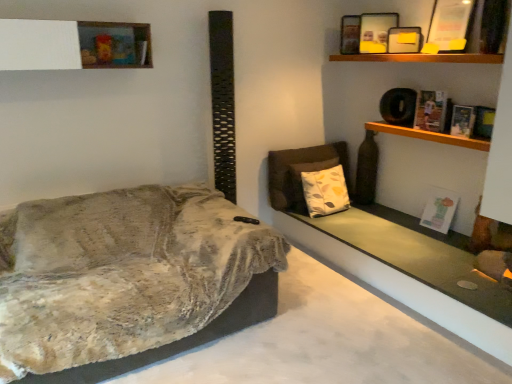
At what (x,y) coordinates should I click in order to perform the action: click on wooden shelf at upper right, the 2th shelf positioned from the top. Please return your answer as a coordinate pair (x, y). The image size is (512, 384). Looking at the image, I should click on (428, 136).

The width and height of the screenshot is (512, 384). What do you see at coordinates (122, 272) in the screenshot?
I see `velvet beige couch at left` at bounding box center [122, 272].

This screenshot has height=384, width=512. Describe the element at coordinates (376, 31) in the screenshot. I see `matte black picture frame at upper right, placed as the first picture frame when sorted from back to front` at that location.

Where is `wooden shelf at upper right, the first shelf ordered from the bottom`? The height and width of the screenshot is (384, 512). wooden shelf at upper right, the first shelf ordered from the bottom is located at coordinates (428, 136).

Is matte black picture frame at upper right, placed as the first picture frame when sorted from back to front, oriented towards brown fabric armchair at center?

No, matte black picture frame at upper right, placed as the first picture frame when sorted from back to front, is not facing towards brown fabric armchair at center.

Who is smaller, matte black picture frame at upper right, placed as the first picture frame when sorted from back to front, or brown fabric armchair at center?

Smaller between the two is matte black picture frame at upper right, placed as the first picture frame when sorted from back to front.

Can you confirm if matte black picture frame at upper right, arranged as the 2th picture frame when viewed from the front, is shorter than brown fabric armchair at center?

Yes, matte black picture frame at upper right, arranged as the 2th picture frame when viewed from the front, is shorter than brown fabric armchair at center.

Are matte black picture frame at upper right, placed as the first picture frame when sorted from back to front, and brown fabric armchair at center far apart?

matte black picture frame at upper right, placed as the first picture frame when sorted from back to front, is positioned a significant distance from brown fabric armchair at center.

Are brown fabric armchair at center and smooth concrete window sill at lower right making contact?

No, brown fabric armchair at center is not in contact with smooth concrete window sill at lower right.

Would you say brown fabric armchair at center is inside or outside smooth concrete window sill at lower right?

brown fabric armchair at center is outside smooth concrete window sill at lower right.

From a real-world perspective, between brown fabric armchair at center and smooth concrete window sill at lower right, who is vertically lower?

In real-world perspective, smooth concrete window sill at lower right is lower.

In order to click on armchair that is behind the smooth concrete window sill at lower right in this screenshot , I will do `click(301, 172)`.

Consider the image. From a real-world perspective, who is located lower, white matte shelf at upper left, marked as the 2th shelf in a right-to-left arrangement, or hardcover book at upper right, placed as the second book when sorted from bottom to top?

hardcover book at upper right, placed as the second book when sorted from bottom to top, is physically lower.

Which shelf is the 2nd one when counting from the left side of the hardcover book at upper right, the 3th book when ordered from top to bottom? Please provide its 2D coordinates.

[(65, 44)]

Between white matte shelf at upper left, the 1th shelf when ordered from top to bottom, and hardcover book at upper right, placed as the second book when sorted from bottom to top, which one has more height?

With more height is white matte shelf at upper left, the 1th shelf when ordered from top to bottom.

Considering the positions of objects white matte shelf at upper left, the 2th shelf positioned from the bottom, and hardcover book at upper right, the 3th book when ordered from top to bottom, in the image provided, who is behind, white matte shelf at upper left, the 2th shelf positioned from the bottom, or hardcover book at upper right, the 3th book when ordered from top to bottom,?

hardcover book at upper right, the 3th book when ordered from top to bottom, is behind.

How many degrees apart are the facing directions of matte black picture frame at upper right, arranged as the 2th picture frame when viewed from the front, and hardcover book at upper right, the 3th book when ordered from top to bottom?

matte black picture frame at upper right, arranged as the 2th picture frame when viewed from the front, and hardcover book at upper right, the 3th book when ordered from top to bottom, are facing 86.2 degrees away from each other.

Between matte black picture frame at upper right, arranged as the 2th picture frame when viewed from the front, and hardcover book at upper right, placed as the second book when sorted from bottom to top, which one has smaller size?

Smaller between the two is hardcover book at upper right, placed as the second book when sorted from bottom to top.

Is matte black picture frame at upper right, placed as the first picture frame when sorted from back to front, in front of hardcover book at upper right, placed as the second book when sorted from bottom to top?

That is False.

Is matte black picture frame at upper right, placed as the first picture frame when sorted from back to front, shorter than hardcover book at upper right, placed as the second book when sorted from bottom to top?

No.

Can you tell me how much white paper at upper right, the fourth book positioned from the top, and matte black picture frame at upper center, arranged as the first picture frame when viewed from the front, differ in facing direction?

52.1 degrees.

From the image's perspective, is white paper at upper right, the fourth book positioned from the top, positioned above or below matte black picture frame at upper center, marked as the second picture frame in a back-to-front arrangement?

Clearly, from the image's perspective, white paper at upper right, the fourth book positioned from the top, is below matte black picture frame at upper center, marked as the second picture frame in a back-to-front arrangement.

Looking at this image, would you consider white paper at upper right, the fourth book positioned from the top, to be distant from matte black picture frame at upper center, arranged as the first picture frame when viewed from the front?

white paper at upper right, the fourth book positioned from the top, is positioned a significant distance from matte black picture frame at upper center, arranged as the first picture frame when viewed from the front.

Which is more to the right, white paper at upper right, the fourth book positioned from the top, or matte black picture frame at upper center, marked as the second picture frame in a back-to-front arrangement?

white paper at upper right, the fourth book positioned from the top.

Are matte black picture frame at upper center, arranged as the first picture frame when viewed from the front, and white printed cushion at center beside each other?

No.

Which point is more distant from viewer, (410, 40) or (305, 174)?

The point (305, 174) is behind.

Looking at the image, does matte black picture frame at upper center, marked as the second picture frame in a back-to-front arrangement, seem bigger or smaller compared to white printed cushion at center?

Clearly, matte black picture frame at upper center, marked as the second picture frame in a back-to-front arrangement, is smaller in size than white printed cushion at center.

Would you say matte black picture frame at upper center, arranged as the first picture frame when viewed from the front, is inside or outside white printed cushion at center?

matte black picture frame at upper center, arranged as the first picture frame when viewed from the front, is spatially situated outside white printed cushion at center.

Where is `pillow behind the matte black picture frame at upper right, arranged as the 2th picture frame when viewed from the front`? pillow behind the matte black picture frame at upper right, arranged as the 2th picture frame when viewed from the front is located at coordinates (325, 191).

Can you tell me how much matte black picture frame at upper right, arranged as the 2th picture frame when viewed from the front, and white printed cushion at center differ in facing direction?

matte black picture frame at upper right, arranged as the 2th picture frame when viewed from the front, and white printed cushion at center are facing 25.3 degrees away from each other.

From a real-world perspective, is matte black picture frame at upper right, arranged as the 2th picture frame when viewed from the front, positioned over white printed cushion at center based on gravity?

Indeed, from a real-world perspective, matte black picture frame at upper right, arranged as the 2th picture frame when viewed from the front, stands above white printed cushion at center.

From the image's perspective, is matte black picture frame at upper right, arranged as the 2th picture frame when viewed from the front, above white printed cushion at center?

Yes, from the image's perspective, matte black picture frame at upper right, arranged as the 2th picture frame when viewed from the front, is over white printed cushion at center.

I want to click on armchair that is below the matte black picture frame at upper right, placed as the first picture frame when sorted from back to front (from the image's perspective), so click(301, 172).

What are the coordinates of `window sill below the brown fabric armchair at center (from a real-world perspective)` in the screenshot? It's located at (417, 254).

When comparing their distances from hardcover book at upper right, placed as the second book when sorted from bottom to top, does white matte shelf at upper left, the 1th shelf when ordered from top to bottom, or matte black picture frame at upper right, arranged as the 2th picture frame when viewed from the front, seem further?

Among the two, white matte shelf at upper left, the 1th shelf when ordered from top to bottom, is located further to hardcover book at upper right, placed as the second book when sorted from bottom to top.

Based on their spatial positions, is smooth concrete window sill at lower right or white printed cushion at center further from matte paper book at upper right, which appears as the 1th book when viewed from the top?

The object further to matte paper book at upper right, which appears as the 1th book when viewed from the top, is smooth concrete window sill at lower right.

Estimate the real-world distances between objects in this image. Which object is further from matte paper book at upper right, the fourth book when ordered from bottom to top, wooden shelf at upper right, which ranks as the second shelf in left-to-right order, or matte black picture frame at upper right, arranged as the 2th picture frame when viewed from the front?

matte black picture frame at upper right, arranged as the 2th picture frame when viewed from the front, lies further to matte paper book at upper right, the fourth book when ordered from bottom to top, than the other object.

Estimate the real-world distances between objects in this image. Which object is closer to brown fabric armchair at center, white paper at upper right, the first book in the bottom-to-top sequence, or hardcover book at upper right, placed as the second book when sorted from bottom to top?

white paper at upper right, the first book in the bottom-to-top sequence, is positioned closer to the anchor brown fabric armchair at center.

Which object lies further to the anchor point matte black picture frame at upper center, marked as the second picture frame in a back-to-front arrangement, white paper at upper right, the fourth book positioned from the top, or matte black picture frame at upper right, arranged as the 2th picture frame when viewed from the front?

white paper at upper right, the fourth book positioned from the top.

When comparing their distances from wooden shelf at upper right, the first shelf ordered from the bottom, does matte black picture frame at upper center, arranged as the first picture frame when viewed from the front, or white matte shelf at upper left, marked as the 2th shelf in a right-to-left arrangement, seem closer?

matte black picture frame at upper center, arranged as the first picture frame when viewed from the front.

From the image, which object appears to be nearer to hardcover book at upper right, placed as the second book when sorted from bottom to top, smooth concrete window sill at lower right or wooden shelf at upper right, which is the 1th shelf from right to left?

wooden shelf at upper right, which is the 1th shelf from right to left, is positioned closer to the anchor hardcover book at upper right, placed as the second book when sorted from bottom to top.

From the image, which object appears to be nearer to brown fabric armchair at center, hardcover book at upper right, the 2th book positioned from the top, or velvet beige couch at left?

hardcover book at upper right, the 2th book positioned from the top, lies closer to brown fabric armchair at center than the other object.

The height and width of the screenshot is (384, 512). Identify the location of picture frame situated between velvet beige couch at left and matte black picture frame at upper center, arranged as the first picture frame when viewed from the front, from left to right. (376, 31).

Identify the location of window sill located between white matte shelf at upper left, marked as the 2th shelf in a right-to-left arrangement, and hardcover book at upper right, the 3th book when ordered from top to bottom, in the left-right direction. The image size is (512, 384). (417, 254).

Identify the location of studio couch situated between white matte shelf at upper left, marked as the 2th shelf in a right-to-left arrangement, and smooth concrete window sill at lower right from left to right. This screenshot has width=512, height=384. (122, 272).

This screenshot has width=512, height=384. Find the location of `armchair between velvet beige couch at left and hardcover book at upper right, the 3th book when ordered from top to bottom, from left to right`. armchair between velvet beige couch at left and hardcover book at upper right, the 3th book when ordered from top to bottom, from left to right is located at coordinates (301, 172).